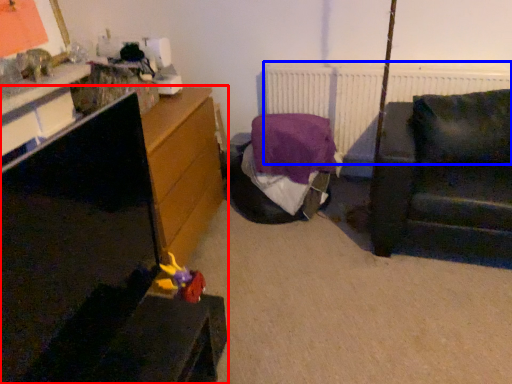
Question: Which of the following is the closest to the observer, furniture (highlighted by a red box) or radiator (highlighted by a blue box)?

Choices:
 (A) furniture
 (B) radiator

Answer: (A)